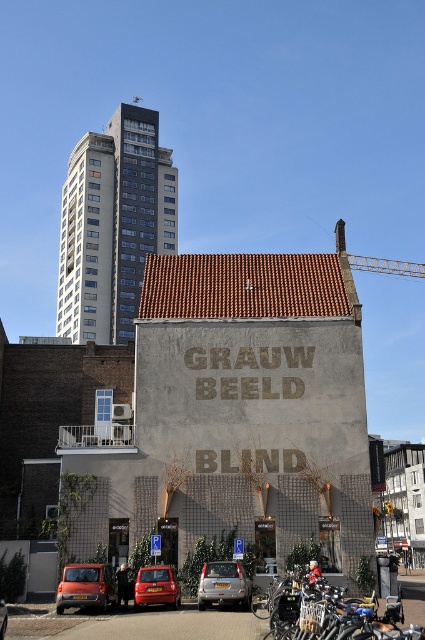
You are standing at the entrance of the building and want to walk to a specific location. There are two points marked on the pavement in front of you. The first point is at coordinates point (107,593) and the second is at point (204,584). Which point should you walk towards if you want to reach the one that is closer to the building?

Point (107,593) is behind point (204,584), so if you want to reach the one closer to the building, you should walk towards point (204,584) because it is in front of point (107,593).

You are a pedestrian standing at the entrance of the building and want to cross the street. You see the matte orange car at lower left and the silver metallic car at center. Which car is closer to you?

The matte orange car at lower left is closer to you because it is in front of the silver metallic car at center.

You are a pedestrian standing at the entrance of the building and want to cross to the other side of the street. There are two cars in your path, the matte orange car at lower left and the matte red car at lower center. Which car is closer to you that you need to avoid first?

The matte orange car at lower left is positioned over the matte red car at lower center, meaning it is closer to you. You should avoid the matte orange car at lower left first.